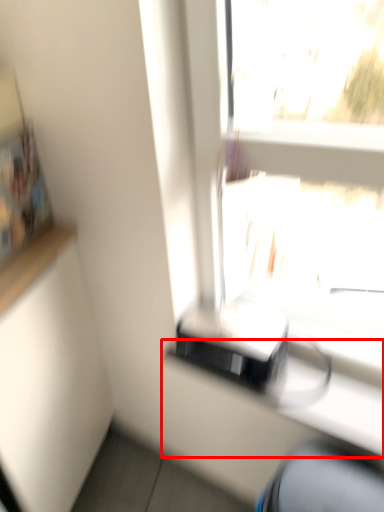
Question: From the image's perspective, where is counter (annotated by the red box) located relative to computer chair?

Choices:
 (A) below
 (B) above

Answer: (B)